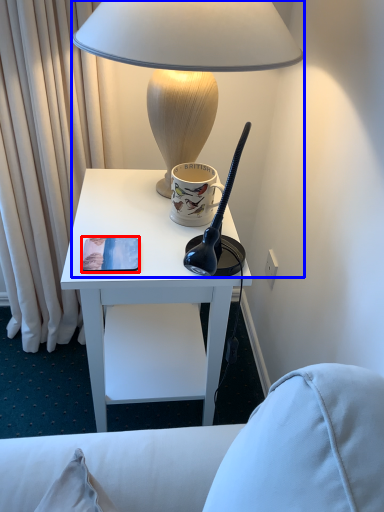
Question: Among these objects, which one is farthest to the camera, pad (highlighted by a red box) or lamp (highlighted by a blue box)?

Choices:
 (A) pad
 (B) lamp

Answer: (A)